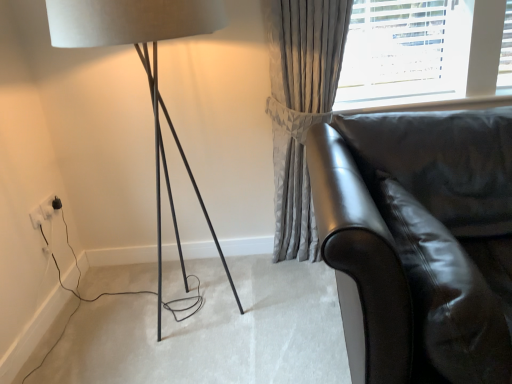
Question: Can you confirm if satin grey curtain at upper right is shorter than white plastic electric outlet at lower left, which is counted as the 2th electric outlet, starting from the back?

Choices:
 (A) yes
 (B) no

Answer: (B)

Question: Is satin grey curtain at upper right thinner than white plastic electric outlet at lower left, which is counted as the 2th electric outlet, starting from the back?

Choices:
 (A) yes
 (B) no

Answer: (B)

Question: Is satin grey curtain at upper right far from white plastic electric outlet at lower left, which is counted as the 2th electric outlet, starting from the back?

Choices:
 (A) no
 (B) yes

Answer: (B)

Question: Is white plastic electric outlet at lower left, which is counted as the 2th electric outlet, starting from the back, at the back of satin grey curtain at upper right?

Choices:
 (A) yes
 (B) no

Answer: (B)

Question: Does satin grey curtain at upper right have a smaller size compared to white plastic electric outlet at lower left, acting as the first electric outlet starting from the front?

Choices:
 (A) no
 (B) yes

Answer: (A)

Question: Considering the relative positions of satin grey curtain at upper right and white plastic electric outlet at lower left, which is counted as the 2th electric outlet, starting from the back, in the image provided, is satin grey curtain at upper right to the right of white plastic electric outlet at lower left, which is counted as the 2th electric outlet, starting from the back, from the viewer's perspective?

Choices:
 (A) no
 (B) yes

Answer: (B)

Question: Is matte black lamp at left positioned in front of satin grey curtain at upper right?

Choices:
 (A) yes
 (B) no

Answer: (A)

Question: From a real-world perspective, is matte black lamp at left on top of satin grey curtain at upper right?

Choices:
 (A) yes
 (B) no

Answer: (A)

Question: Is matte black lamp at left facing towards satin grey curtain at upper right?

Choices:
 (A) no
 (B) yes

Answer: (A)

Question: Is matte black lamp at left further to the viewer compared to satin grey curtain at upper right?

Choices:
 (A) no
 (B) yes

Answer: (A)

Question: Is matte black lamp at left located outside satin grey curtain at upper right?

Choices:
 (A) no
 (B) yes

Answer: (B)

Question: Can you confirm if matte black lamp at left is taller than satin grey curtain at upper right?

Choices:
 (A) yes
 (B) no

Answer: (A)

Question: Considering the relative sizes of white plastic electric outlet at lower left, acting as the first electric outlet starting from the front, and matte black lamp at left in the image provided, is white plastic electric outlet at lower left, acting as the first electric outlet starting from the front, smaller than matte black lamp at left?

Choices:
 (A) yes
 (B) no

Answer: (A)